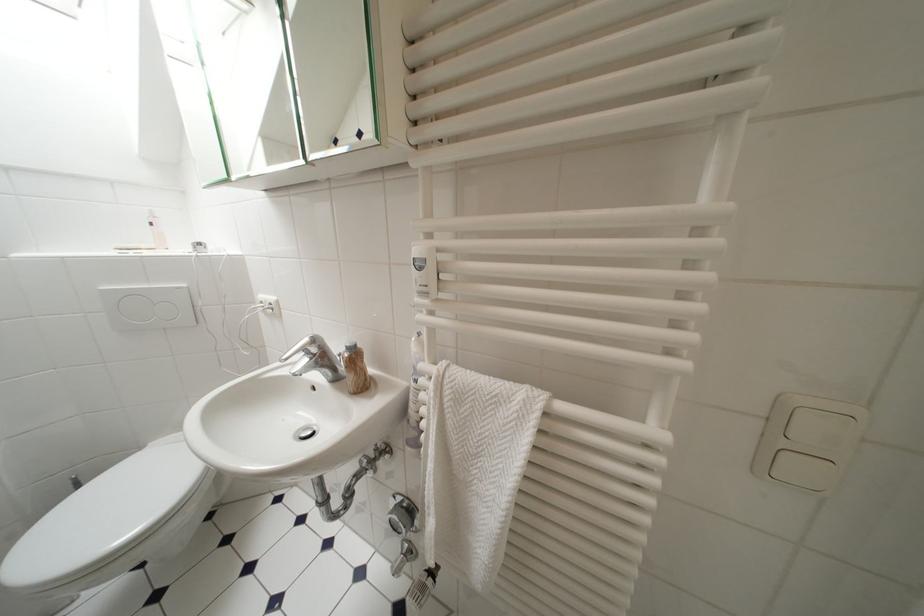
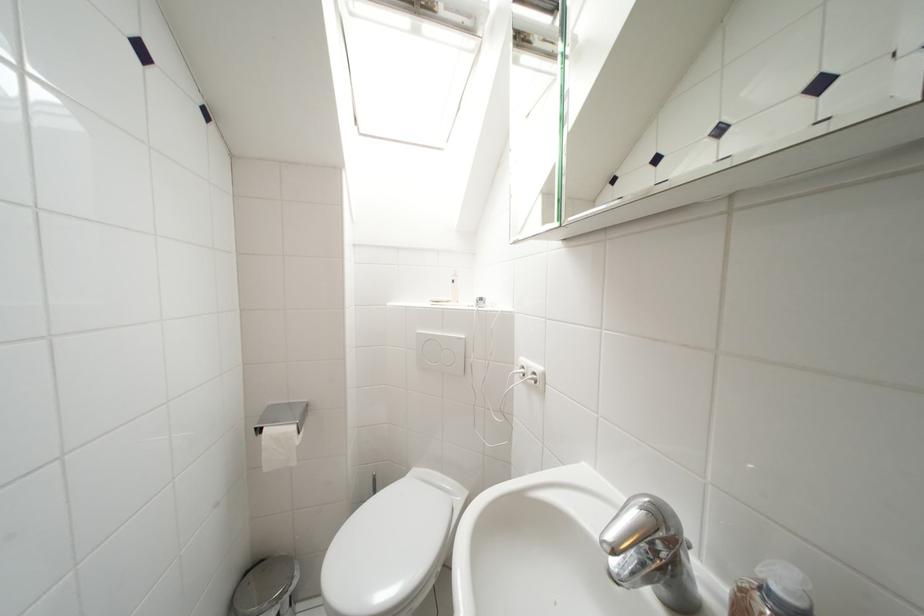
Find the pixel in the second image that matches [277,307] in the first image.

(541, 377)